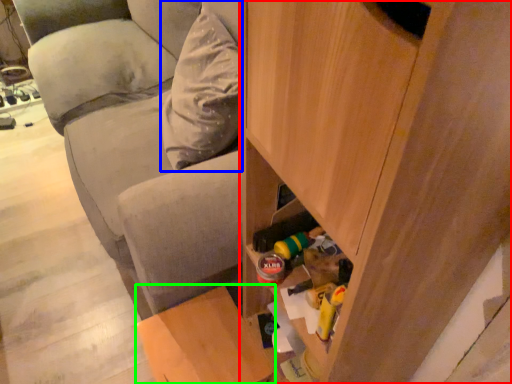
Question: Considering the real-world distances, which object is farthest from cabinetry (highlighted by a red box)? pillow (highlighted by a blue box) or furniture (highlighted by a green box)?

Choices:
 (A) pillow
 (B) furniture

Answer: (A)